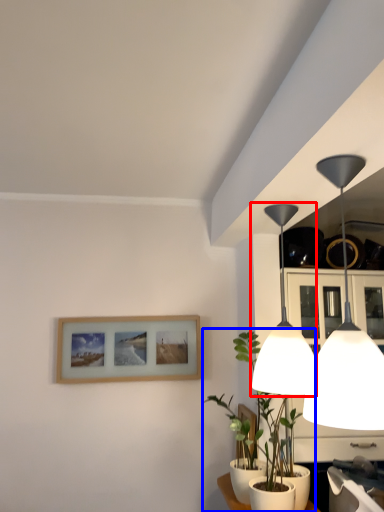
Question: Among these objects, which one is farthest to the camera, lamp (highlighted by a red box) or houseplant (highlighted by a blue box)?

Choices:
 (A) lamp
 (B) houseplant

Answer: (B)